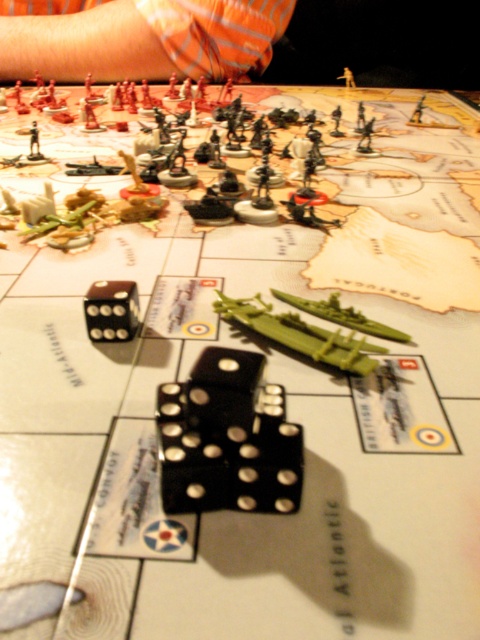
You are a game player trying to place a new miniature soldier on the table. The orange striped shirt at upper left and the black rubber dice at center are already on the table. Which object has a greater width?

The orange striped shirt at upper left has a greater width than the black rubber dice at center.

You are a player in a tabletop wargame and need to determine the order of actions based on proximity to the camera. Which of the two points, point (79, 38) or point (195, 406), is closer to you?

Point (79, 38) is closer to the camera than point (195, 406).

You are a player in a tabletop wargame looking at the game board. You see an orange striped shirt at upper left and black rubber dice at center. Which object is closer to you?

The orange striped shirt at upper left is positioned over the black rubber dice at center, meaning it is closer to you.